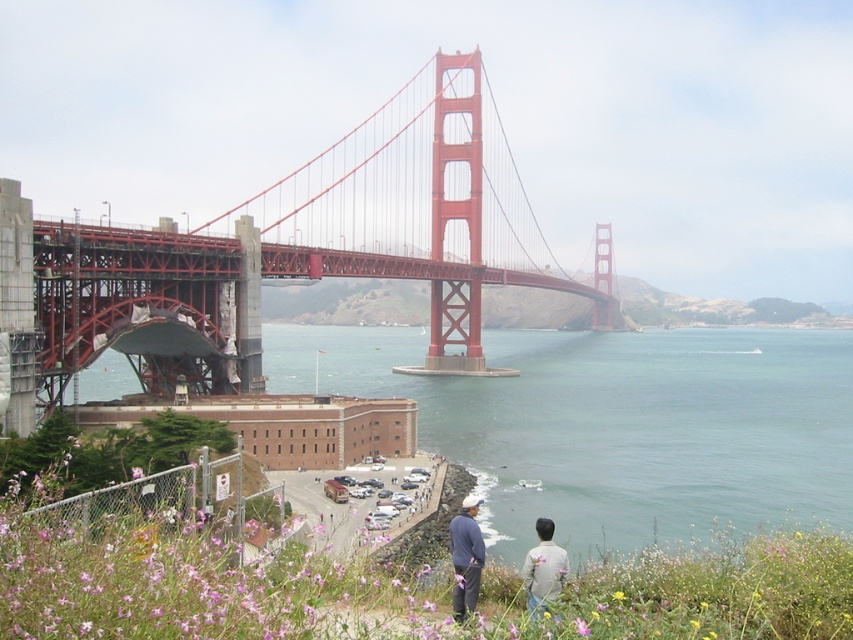
You are a photographer planning to capture the Golden Gate Bridge from the grassy area with wildflowers. To include the clear blue water at center in your shot, where should you position your camera relative to the bridge?

The clear blue water at center is located at point coordinates approximately 0.666 on the x axis and 0.723 on the y axis. To capture it, align your camera so that the water is centered at those coordinates relative to the bridge in the frame.

You are a photographer planning to take a photo of the Golden Gate Bridge. You notice two people in the scene wearing gray fabric pants at center and gray cotton shirt at lower right. Which clothing item is covering the other?

The gray fabric pants at center is positioned over gray cotton shirt at lower right, so the pants are covering the shirt.

You are a photographer trying to capture both the gray fabric pants at center and the gray cotton shirt at lower right in a single shot. Which of the two objects should you focus on first to ensure both are in clear view?

You should focus on the gray fabric pants at center first because it is closer to you than the gray cotton shirt at lower right, ensuring both will be in focus when using a camera with depth of field considerations.